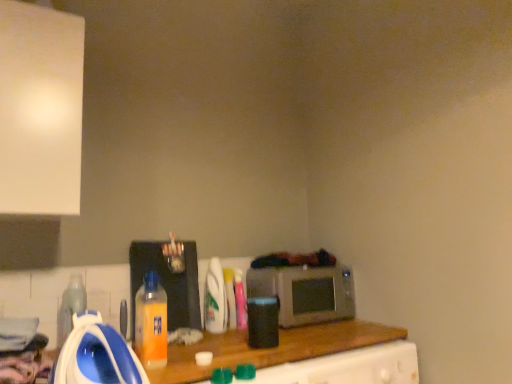
Question: Considering their positions, is translucent plastic bottle at center, arranged as the second appliance when viewed from the front, located in front of or behind translucent plastic bottle at center, the third bottle from the left?

Choices:
 (A) behind
 (B) front

Answer: (B)

Question: From the image's perspective, is translucent plastic bottle at center, arranged as the second appliance when viewed from the front, above or below translucent plastic bottle at center, arranged as the 3th bottle when viewed from the back?

Choices:
 (A) above
 (B) below

Answer: (A)

Question: Which is nearer to the metallic silver microwave at center?

Choices:
 (A) translucent plastic bottle at center, which is counted as the third bottle, starting from the front
 (B) translucent plastic bottle at center, arranged as the first bottle when viewed from the back
 (C) orange plastic bottle at center, which is counted as the 1th bottle, starting from the front
 (D) blue plastic iron at lower left, arranged as the first appliance when viewed from the front
 (E) translucent plastic bottle at lower left, which is the second bottle from front to back

Answer: (B)

Question: Which object is the closest to the translucent plastic bottle at center, the first appliance viewed from the back?

Choices:
 (A) translucent plastic bottle at center, which is the fifth bottle in left-to-right order
 (B) orange plastic bottle at center, the 4th bottle from the right
 (C) blue plastic iron at lower left, which is counted as the 2th appliance, starting from the back
 (D) metallic silver microwave at center
 (E) translucent plastic bottle at center, arranged as the first bottle when viewed from the back

Answer: (E)